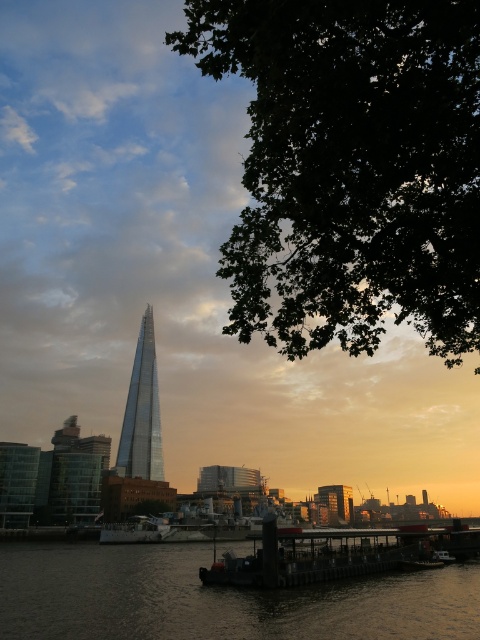
Does green leafy tree at upper right have a lesser width compared to glassy metallic tower at center?

In fact, green leafy tree at upper right might be wider than glassy metallic tower at center.

Is the position of green leafy tree at upper right less distant than that of glassy metallic tower at center?

Yes.

Does point (412, 17) come in front of point (146, 355)?

That is True.

The height and width of the screenshot is (640, 480). What are the coordinates of `green leafy tree at upper right` in the screenshot? It's located at (351, 168).

Measure the distance between glassy metallic tower at center and camera.

glassy metallic tower at center and camera are 172.20 meters apart from each other.

Does glassy metallic tower at center appear over green leafy tree at center?

Correct, glassy metallic tower at center is located above green leafy tree at center.

Locate an element on the screen. This screenshot has height=640, width=480. glassy metallic tower at center is located at coordinates (142, 412).

Does point (317, 92) come closer to viewer compared to point (149, 529)?

Yes, it is.

Does green leafy tree at upper right have a greater height compared to metallic gray ship at center?

Yes, green leafy tree at upper right is taller than metallic gray ship at center.

The width and height of the screenshot is (480, 640). What do you see at coordinates (351, 168) in the screenshot?
I see `green leafy tree at upper right` at bounding box center [351, 168].

Where is `green leafy tree at upper right`? green leafy tree at upper right is located at coordinates [x=351, y=168].